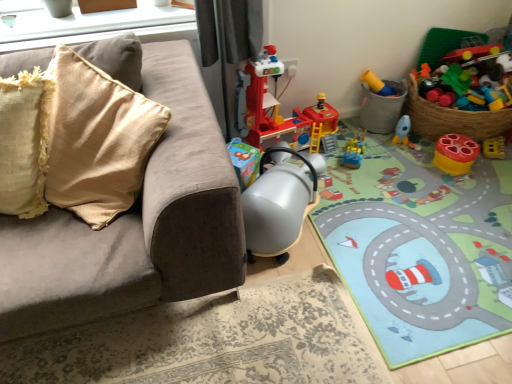
Find the location of a particular element. Image resolution: width=512 pixels, height=384 pixels. free space between matte plastic toy at right, the 5th toy in the left-to-right sequence, and translucent plastic train at center, positioned as the second toy in left-to-right order is located at coordinates (400, 158).